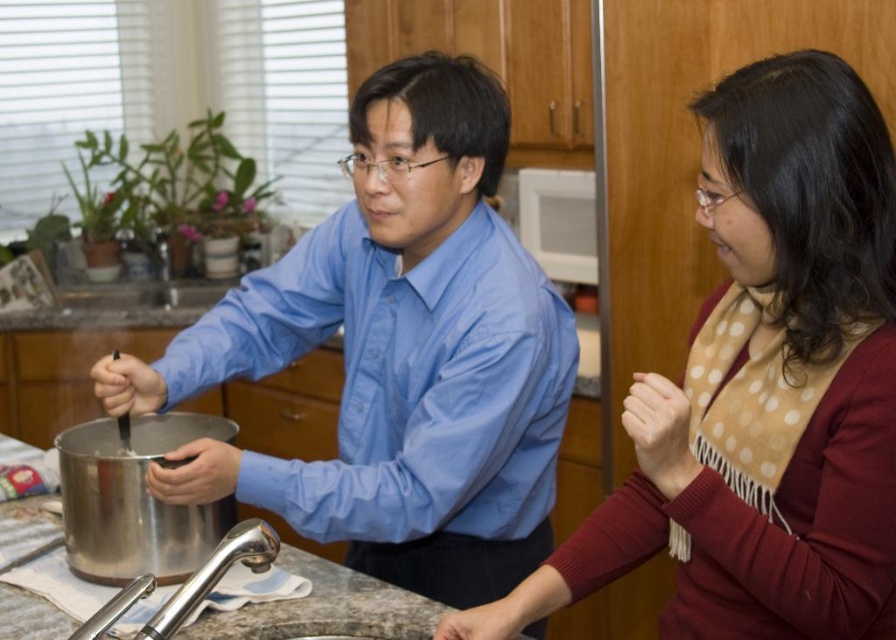
Question: Is matte brown scarf at right thinner than matte blue shirt at center?

Choices:
 (A) yes
 (B) no

Answer: (A)

Question: Is matte brown scarf at right thinner than matte blue shirt at center?

Choices:
 (A) no
 (B) yes

Answer: (B)

Question: Can you confirm if matte brown scarf at right is positioned to the right of matte blue shirt at center?

Choices:
 (A) no
 (B) yes

Answer: (B)